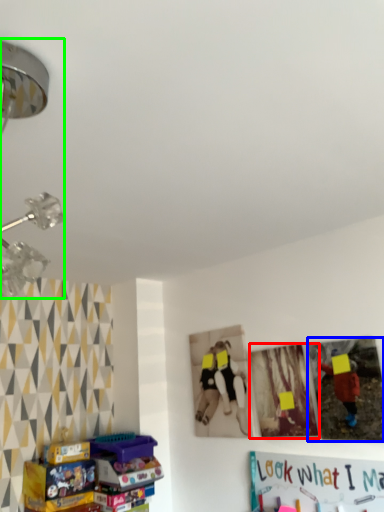
Question: Based on their relative distances, which object is nearer to picture frame (highlighted by a red box)? Choose from picture frame (highlighted by a blue box) and lamp (highlighted by a green box).

Choices:
 (A) picture frame
 (B) lamp

Answer: (A)